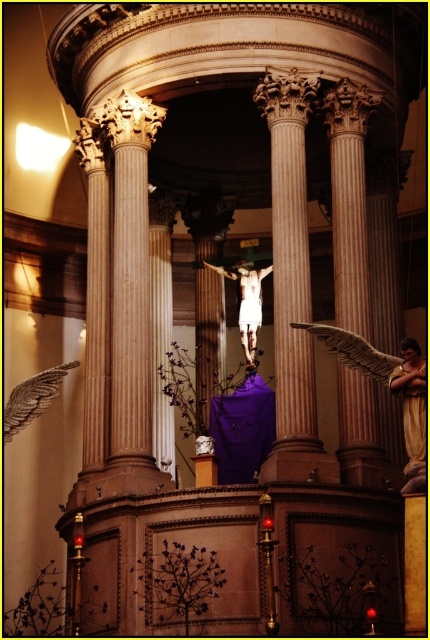
Does point (282, 276) come behind point (208, 262)?

No, (282, 276) is in front of (208, 262).

What are the coordinates of `polished marble column at center` in the screenshot? It's located at (291, 280).

Is polished marble column at center taller than marble column at center?

In fact, polished marble column at center may be shorter than marble column at center.

Is point (292, 358) positioned before point (340, 243)?

Yes, point (292, 358) is closer to viewer.

You are a GUI agent. You are given a task and a screenshot of the screen. Output one action in this format:
    pyautogui.click(x=<x>, y=<y>)
    Task: Click on the polished marble column at center
    Image resolution: width=430 pixels, height=640 pixels.
    Given the screenshot: What is the action you would take?
    pyautogui.click(x=291, y=280)

Is marble column at center positioned behind white marble crucifix at center?

No, it is not.

Does marble column at center have a lesser height compared to white marble crucifix at center?

Incorrect, marble column at center's height does not fall short of white marble crucifix at center's.

This screenshot has width=430, height=640. Identify the location of marble column at center. (349, 198).

Locate an element on the screen. marble column at center is located at coordinates (349, 198).